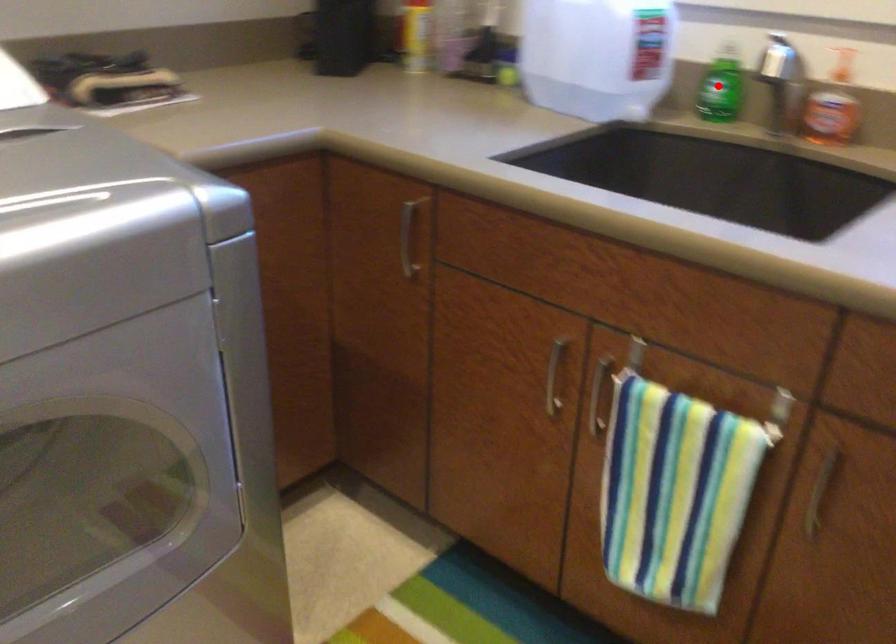
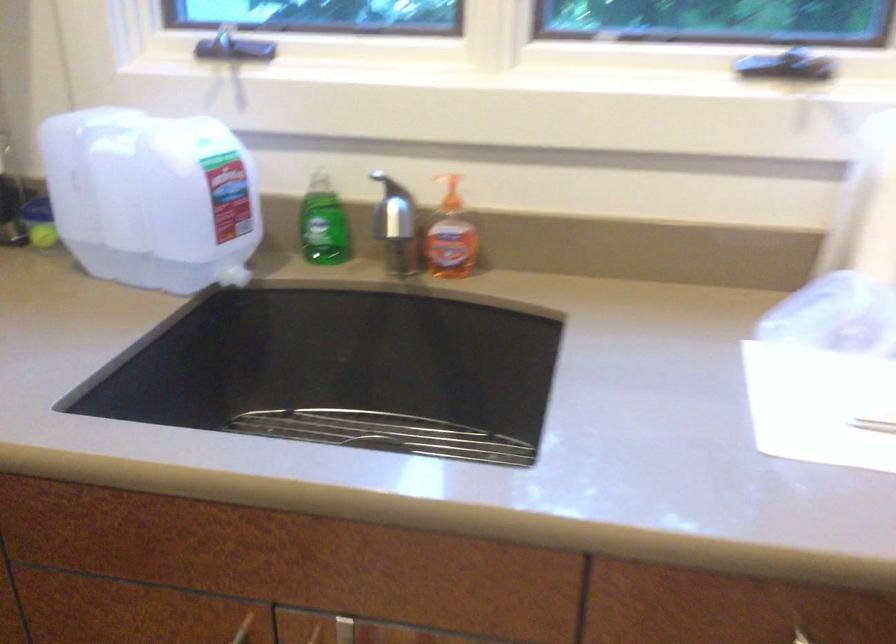
Locate, in the second image, the point that corresponds to the highlighted location in the first image.

(323, 223)